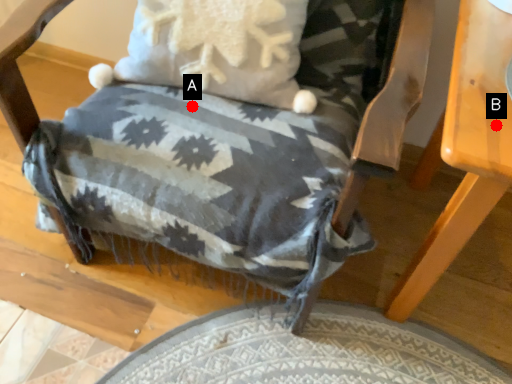
Question: Two points are circled on the image, labeled by A and B beside each circle. Which of the following is the closest to the observer?

Choices:
 (A) A is closer
 (B) B is closer

Answer: (B)